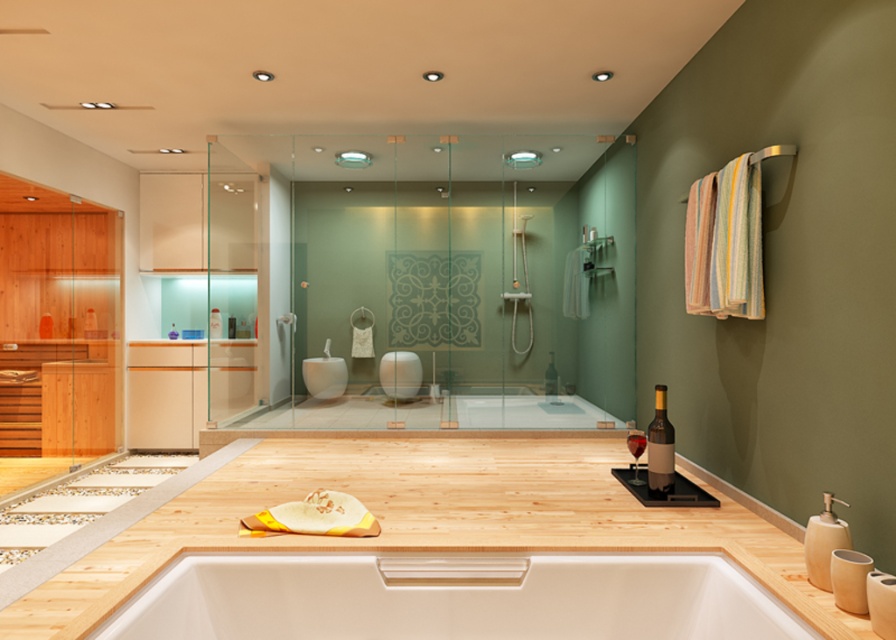
Can you confirm if matte glass wine bottle at center is bigger than dark glass wine at center?

Actually, matte glass wine bottle at center might be smaller than dark glass wine at center.

Between matte glass wine bottle at center and dark glass wine at center, which one appears on the left side from the viewer's perspective?

From the viewer's perspective, dark glass wine at center appears more on the left side.

Between point (670, 424) and point (629, 440), which one is positioned in front?

Point (670, 424) is in front.

The height and width of the screenshot is (640, 896). What are the coordinates of `matte glass wine bottle at center` in the screenshot? It's located at (660, 448).

Where is `brown glass bottle at center`? Image resolution: width=896 pixels, height=640 pixels. brown glass bottle at center is located at coordinates (x=550, y=380).

Between brown glass bottle at center and dark glass wine at center, which one has more height?

With more height is brown glass bottle at center.

Locate an element on the screen. Image resolution: width=896 pixels, height=640 pixels. brown glass bottle at center is located at coordinates (550, 380).

The image size is (896, 640). Identify the location of brown glass bottle at center. (550, 380).

Between point (660, 561) and point (635, 438), which one is positioned in front?

Positioned in front is point (660, 561).

Which of these two, white glossy jacuzzi at lower center or dark glass wine at center, stands shorter?

With less height is dark glass wine at center.

The image size is (896, 640). Describe the element at coordinates (455, 596) in the screenshot. I see `white glossy jacuzzi at lower center` at that location.

You are a GUI agent. You are given a task and a screenshot of the screen. Output one action in this format:
    pyautogui.click(x=<x>, y=<y>)
    Task: Click on the white glossy jacuzzi at lower center
    This screenshot has width=896, height=640.
    Given the screenshot: What is the action you would take?
    coord(455,596)